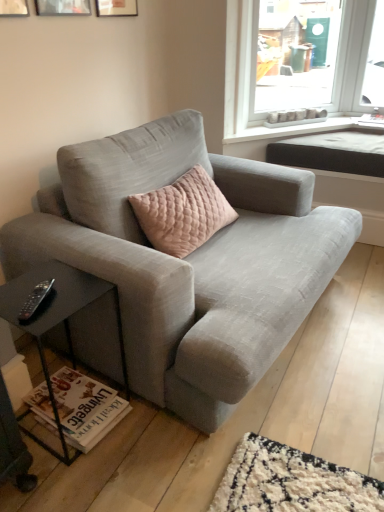
What do you see at coordinates (57, 319) in the screenshot? I see `black matte side table at lower left` at bounding box center [57, 319].

Locate an element on the screen. This screenshot has width=384, height=512. wooden picture frame at upper left, placed as the first picture frame when sorted from left to right is located at coordinates (14, 8).

Locate an element on the screen. textured gray couch at center is located at coordinates (189, 261).

Locate an element on the screen. The height and width of the screenshot is (512, 384). black matte side table at lower left is located at coordinates (57, 319).

Is textured gray couch at center facing towards black plastic remote at lower left?

No, textured gray couch at center is not turned towards black plastic remote at lower left.

Is textured gray couch at center not within black plastic remote at lower left?

Yes, textured gray couch at center is located beyond the bounds of black plastic remote at lower left.

Based on the photo, is metallic silver picture frame at upper left, which is the 2th picture frame from left to right, shorter than black plastic remote at lower left?

Incorrect, the height of metallic silver picture frame at upper left, which is the 2th picture frame from left to right, does not fall short of that of black plastic remote at lower left.

Between point (89, 6) and point (35, 295), which one is positioned in front?

The point (35, 295) is in front.

How far apart are metallic silver picture frame at upper left, placed as the 2th picture frame when sorted from right to left, and black plastic remote at lower left?

1.20 meters.

Considering the positions of objects metallic silver picture frame at upper left, placed as the 2th picture frame when sorted from right to left, and black plastic remote at lower left in the image provided, who is more to the left, metallic silver picture frame at upper left, placed as the 2th picture frame when sorted from right to left, or black plastic remote at lower left?

From the viewer's perspective, metallic silver picture frame at upper left, placed as the 2th picture frame when sorted from right to left, appears more on the left side.

Which object is thinner, wooden picture frame at upper left, placed as the first picture frame when sorted from left to right, or black plastic remote at lower left?

wooden picture frame at upper left, placed as the first picture frame when sorted from left to right.

From the image's perspective, who appears lower, wooden picture frame at upper left, which is counted as the 3th picture frame, starting from the right, or black plastic remote at lower left?

black plastic remote at lower left is shown below in the image.

In the scene shown: Is wooden picture frame at upper left, placed as the first picture frame when sorted from left to right, next to black plastic remote at lower left?

wooden picture frame at upper left, placed as the first picture frame when sorted from left to right, and black plastic remote at lower left are not in contact.

Between wooden picture frame at upper left, placed as the first picture frame when sorted from left to right, and black plastic remote at lower left, which one appears on the right side from the viewer's perspective?

From the viewer's perspective, black plastic remote at lower left appears more on the right side.

From the image's perspective, is black plastic remote at lower left beneath black matte side table at lower left?

No, from the image's perspective, black plastic remote at lower left is not below black matte side table at lower left.

This screenshot has width=384, height=512. I want to click on remote behind the black matte side table at lower left, so click(x=35, y=298).

Which object is positioned more to the right, black plastic remote at lower left or black matte side table at lower left?

Positioned to the right is black matte side table at lower left.

Consider the image. Which of these two, black plastic remote at lower left or black matte side table at lower left, stands taller?

With more height is black matte side table at lower left.

How different are the orientations of black plastic remote at lower left and textured gray couch at center in degrees?

26.4 degrees separate the facing orientations of black plastic remote at lower left and textured gray couch at center.

Is black plastic remote at lower left turned away from textured gray couch at center?

No, black plastic remote at lower left's orientation is not away from textured gray couch at center.

From their relative heights in the image, would you say black plastic remote at lower left is taller or shorter than textured gray couch at center?

Clearly, black plastic remote at lower left is shorter compared to textured gray couch at center.

Based on the photo, does black plastic remote at lower left have a smaller size compared to textured gray couch at center?

Yes, black plastic remote at lower left is smaller than textured gray couch at center.

From the image's perspective, which object appears higher, matte wooden picture frame at upper center, the first picture frame viewed from the right, or textured gray couch at center?

matte wooden picture frame at upper center, the first picture frame viewed from the right, is shown above in the image.

From the picture: Is matte wooden picture frame at upper center, the first picture frame viewed from the right, aimed at textured gray couch at center?

No, matte wooden picture frame at upper center, the first picture frame viewed from the right, does not turn towards textured gray couch at center.

Is point (100, 2) behind point (95, 246)?

Yes, it is behind point (95, 246).

Does matte wooden picture frame at upper center, the 3th picture frame positioned from the left, come behind textured gray couch at center?

Yes, matte wooden picture frame at upper center, the 3th picture frame positioned from the left, is further from the viewer.

How many degrees apart are the facing directions of matte wooden picture frame at upper center, the first picture frame viewed from the right, and black matte side table at lower left?

They differ by 5.47 degrees in their facing directions.

From the image's perspective, which is below, matte wooden picture frame at upper center, the first picture frame viewed from the right, or black matte side table at lower left?

black matte side table at lower left is shown below in the image.

Is black matte side table at lower left a part of matte wooden picture frame at upper center, the first picture frame viewed from the right?

That's incorrect, black matte side table at lower left is not inside matte wooden picture frame at upper center, the first picture frame viewed from the right.

Considering the positions of objects matte wooden picture frame at upper center, the first picture frame viewed from the right, and black matte side table at lower left in the image provided, who is behind, matte wooden picture frame at upper center, the first picture frame viewed from the right, or black matte side table at lower left?

matte wooden picture frame at upper center, the first picture frame viewed from the right, is further from the camera.

Locate an element on the screen. Image resolution: width=384 pixels, height=512 pixels. remote below the textured gray couch at center (from the image's perspective) is located at coordinates [35, 298].

What are the coordinates of `the 2nd picture frame behind the black plastic remote at lower left` in the screenshot? It's located at (62, 7).

Based on their spatial positions, is wooden picture frame at upper left, placed as the first picture frame when sorted from left to right, or metallic silver picture frame at upper left, placed as the 2th picture frame when sorted from right to left, closer to black matte side table at lower left?

Based on the image, wooden picture frame at upper left, placed as the first picture frame when sorted from left to right, appears to be nearer to black matte side table at lower left.

Based on their spatial positions, is black plastic remote at lower left or metallic silver picture frame at upper left, which is the 2th picture frame from left to right, further from wooden picture frame at upper left, placed as the first picture frame when sorted from left to right?

Among the two, black plastic remote at lower left is located further to wooden picture frame at upper left, placed as the first picture frame when sorted from left to right.

When comparing their distances from metallic silver picture frame at upper left, placed as the 2th picture frame when sorted from right to left, does black matte side table at lower left or matte wooden picture frame at upper center, the first picture frame viewed from the right, seem further?

black matte side table at lower left is further to metallic silver picture frame at upper left, placed as the 2th picture frame when sorted from right to left.

From the image, which object appears to be nearer to metallic silver picture frame at upper left, which is the 2th picture frame from left to right, wooden picture frame at upper left, placed as the first picture frame when sorted from left to right, or black plastic remote at lower left?

Among the two, wooden picture frame at upper left, placed as the first picture frame when sorted from left to right, is located nearer to metallic silver picture frame at upper left, which is the 2th picture frame from left to right.

Considering their positions, is black matte side table at lower left positioned closer to wooden picture frame at upper left, placed as the first picture frame when sorted from left to right, than textured gray couch at center?

Based on the image, black matte side table at lower left appears to be nearer to wooden picture frame at upper left, placed as the first picture frame when sorted from left to right.

Considering their positions, is matte wooden picture frame at upper center, the 3th picture frame positioned from the left, positioned closer to wooden picture frame at upper left, placed as the first picture frame when sorted from left to right, than textured gray couch at center?

matte wooden picture frame at upper center, the 3th picture frame positioned from the left, is closer to wooden picture frame at upper left, placed as the first picture frame when sorted from left to right.

Considering their positions, is matte wooden picture frame at upper center, the 3th picture frame positioned from the left, positioned closer to metallic silver picture frame at upper left, placed as the 2th picture frame when sorted from right to left, than black matte side table at lower left?

matte wooden picture frame at upper center, the 3th picture frame positioned from the left, is closer to metallic silver picture frame at upper left, placed as the 2th picture frame when sorted from right to left.

Which object lies further to the anchor point black plastic remote at lower left, wooden picture frame at upper left, placed as the first picture frame when sorted from left to right, or matte wooden picture frame at upper center, the 3th picture frame positioned from the left?

matte wooden picture frame at upper center, the 3th picture frame positioned from the left, is further to black plastic remote at lower left.

Find the location of a particular element. The width and height of the screenshot is (384, 512). studio couch that lies between matte wooden picture frame at upper center, the first picture frame viewed from the right, and black plastic remote at lower left from top to bottom is located at coordinates (189, 261).

Find the location of a particular element. Image resolution: width=384 pixels, height=512 pixels. picture frame between wooden picture frame at upper left, placed as the first picture frame when sorted from left to right, and matte wooden picture frame at upper center, the first picture frame viewed from the right, from front to back is located at coordinates (62, 7).

The image size is (384, 512). I want to click on studio couch between wooden picture frame at upper left, placed as the first picture frame when sorted from left to right, and black plastic remote at lower left in the up-down direction, so [x=189, y=261].

Find the location of a particular element. remote between metallic silver picture frame at upper left, placed as the 2th picture frame when sorted from right to left, and black matte side table at lower left in the up-down direction is located at coordinates (35, 298).